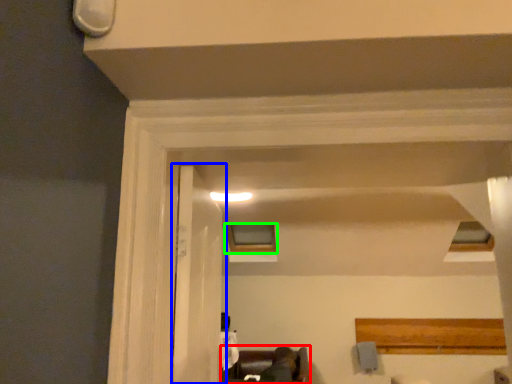
Question: Which object is positioned farthest from furniture (highlighted by a red box)? Select from door (highlighted by a blue box) and window (highlighted by a green box).

Choices:
 (A) door
 (B) window

Answer: (A)